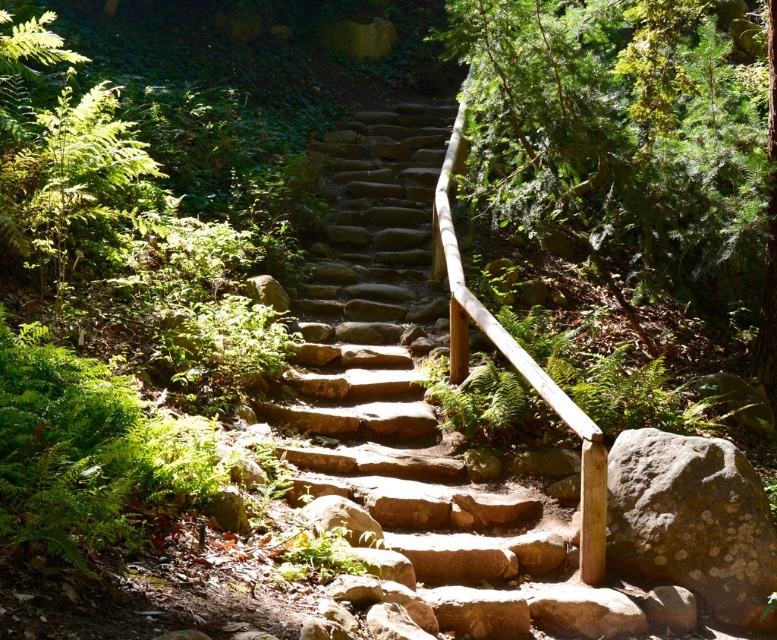
Between point (394, 413) and point (654, 468), which one is positioned behind?

Positioned behind is point (394, 413).

Is natural stone stairs at center taller than gray rough rock at lower right?

Incorrect, natural stone stairs at center's height is not larger of gray rough rock at lower right's.

Is point (354, 282) closer to camera compared to point (639, 432)?

No, it is not.

At what (x,y) coordinates should I click in order to perform the action: click on natural stone stairs at center. Please return your answer as a coordinate pair (x, y). Looking at the image, I should click on (417, 406).